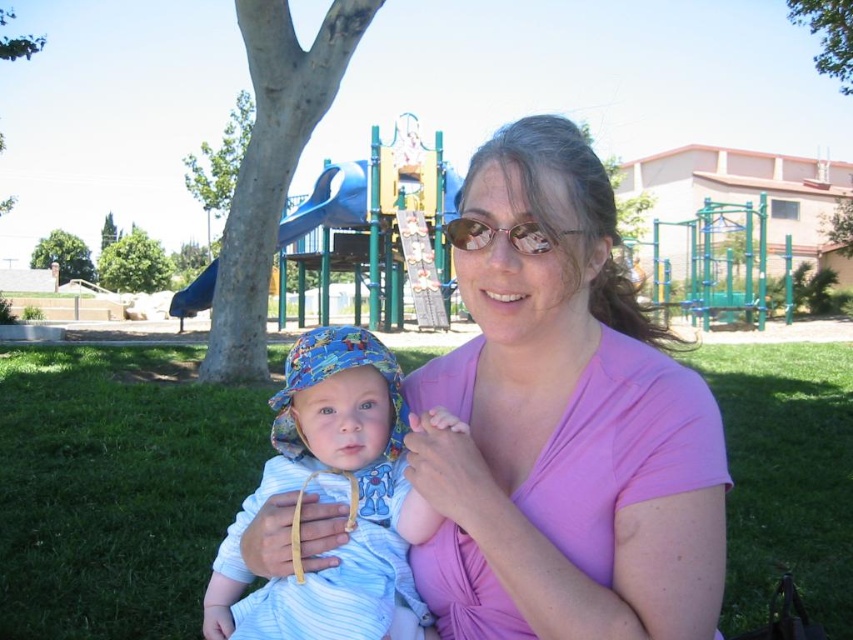
Question: Which of these objects is positioned closest to the blue cotton hat at center?

Choices:
 (A) green grass at lower center
 (B) glossy plastic goggles at center

Answer: (B)

Question: Can you confirm if green grass at lower center is bigger than glossy plastic goggles at center?

Choices:
 (A) no
 (B) yes

Answer: (B)

Question: Is the position of blue cotton hat at center less distant than that of glossy plastic goggles at center?

Choices:
 (A) yes
 (B) no

Answer: (B)

Question: Considering the relative positions of green grass at lower center and glossy plastic goggles at center in the image provided, where is green grass at lower center located with respect to glossy plastic goggles at center?

Choices:
 (A) above
 (B) below

Answer: (B)

Question: Which object is closer to the camera taking this photo?

Choices:
 (A) glossy plastic goggles at center
 (B) green grass at lower center
 (C) blue cotton hat at center
 (D) pink cotton shirt at center

Answer: (D)

Question: Which object appears farthest from the camera in this image?

Choices:
 (A) glossy plastic goggles at center
 (B) blue cotton hat at center

Answer: (B)